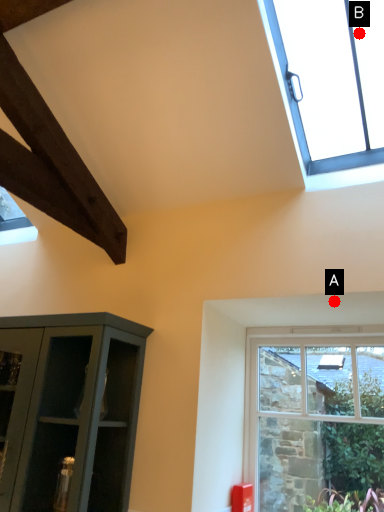
Question: Two points are circled on the image, labeled by A and B beside each circle. Among these points, which one is farthest from the camera?

Choices:
 (A) A is further
 (B) B is further

Answer: (B)